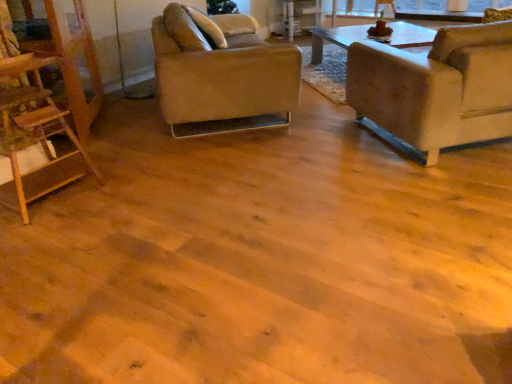
Question: Is wooden ladder at left further to the viewer compared to orange mesh radiator at upper left?

Choices:
 (A) no
 (B) yes

Answer: (A)

Question: Considering the relative sizes of wooden ladder at left and orange mesh radiator at upper left in the image provided, is wooden ladder at left shorter than orange mesh radiator at upper left?

Choices:
 (A) no
 (B) yes

Answer: (A)

Question: Is wooden ladder at left looking in the opposite direction of orange mesh radiator at upper left?

Choices:
 (A) no
 (B) yes

Answer: (A)

Question: Is wooden ladder at left in contact with orange mesh radiator at upper left?

Choices:
 (A) no
 (B) yes

Answer: (A)

Question: Does wooden ladder at left turn towards orange mesh radiator at upper left?

Choices:
 (A) yes
 (B) no

Answer: (B)

Question: From the image's perspective, is wooden ladder at left beneath orange mesh radiator at upper left?

Choices:
 (A) no
 (B) yes

Answer: (B)

Question: From a real-world perspective, is leather-like beige chair at center-left, which is the second chair from right to left, positioned under suede-like beige chair at right, the 2th chair in the left-to-right sequence, based on gravity?

Choices:
 (A) no
 (B) yes

Answer: (B)

Question: From the image's perspective, is leather-like beige chair at center-left, which is the second chair from right to left, above suede-like beige chair at right, the 2th chair in the left-to-right sequence?

Choices:
 (A) no
 (B) yes

Answer: (B)

Question: Does leather-like beige chair at center-left, which is the second chair from right to left, have a larger size compared to suede-like beige chair at right, the 2th chair in the left-to-right sequence?

Choices:
 (A) no
 (B) yes

Answer: (B)

Question: From a real-world perspective, is leather-like beige chair at center-left, which is the second chair from right to left, on top of suede-like beige chair at right, the 2th chair in the left-to-right sequence?

Choices:
 (A) no
 (B) yes

Answer: (A)

Question: Considering the relative sizes of leather-like beige chair at center-left, which is counted as the 1th chair, starting from the left, and suede-like beige chair at right, the 2th chair in the left-to-right sequence, in the image provided, is leather-like beige chair at center-left, which is counted as the 1th chair, starting from the left, smaller than suede-like beige chair at right, the 2th chair in the left-to-right sequence,?

Choices:
 (A) yes
 (B) no

Answer: (B)

Question: Can you confirm if leather-like beige chair at center-left, which is counted as the 1th chair, starting from the left, is wider than suede-like beige chair at right, the first chair in the right-to-left sequence?

Choices:
 (A) no
 (B) yes

Answer: (A)

Question: Would you say suede-like beige chair at right, the 2th chair in the left-to-right sequence, is part of orange mesh radiator at upper left's contents?

Choices:
 (A) yes
 (B) no

Answer: (B)